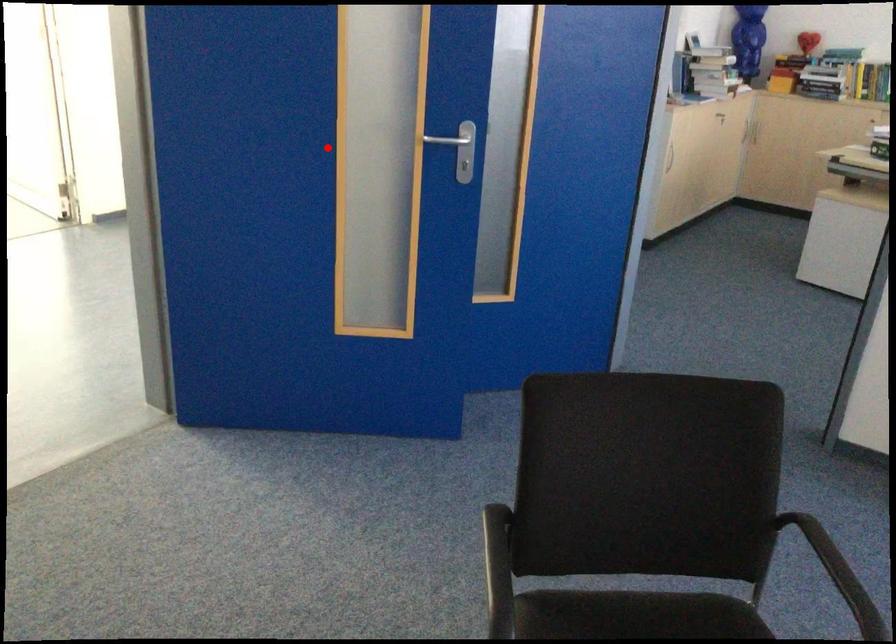
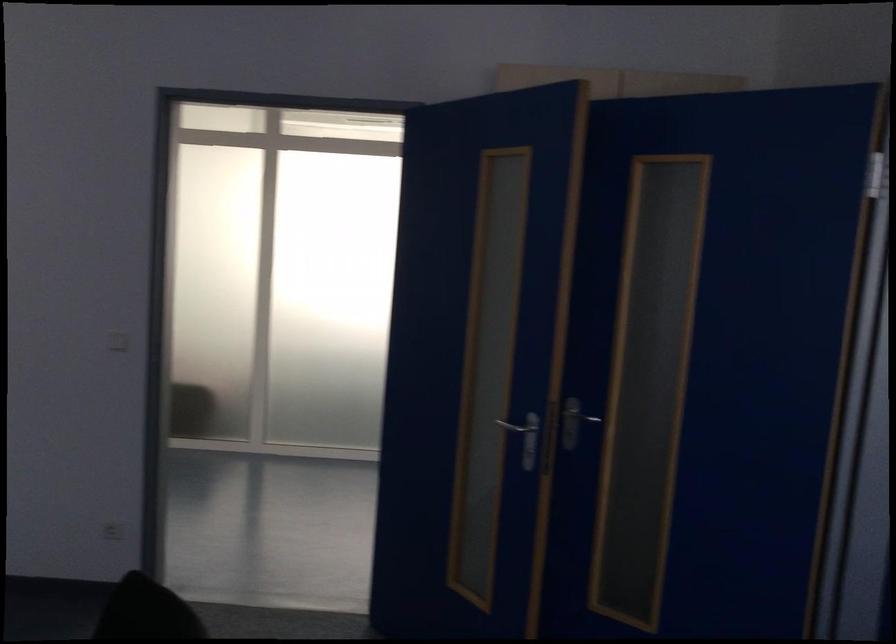
The point at the highlighted location is marked in the first image. Where is the corresponding point in the second image?

(573, 422)